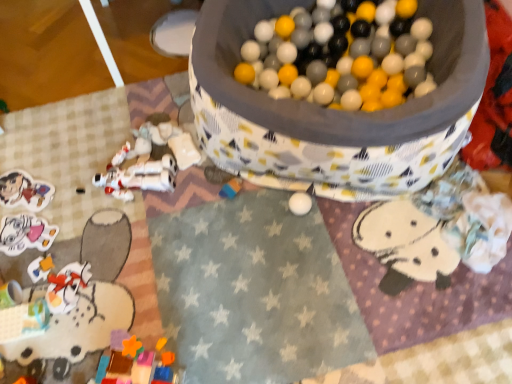
Locate an element on the screen. This screenshot has height=384, width=512. free space between matte white sticker at lower left, the 5th toy when ordered from right to left, and multicolored plastic blocks at center, the 2th toy positioned from the right is located at coordinates (126, 216).